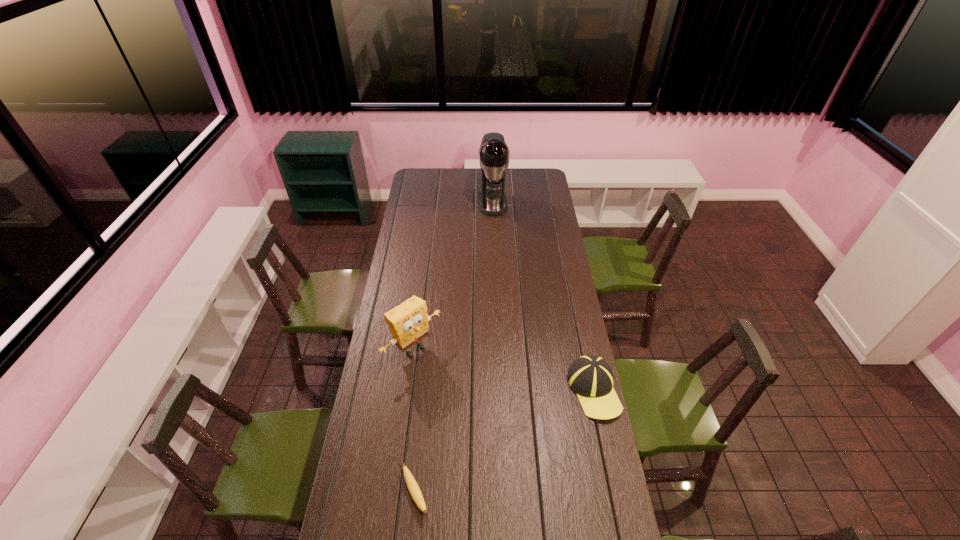
In order to click on object that is the closest to the sponge in this screenshot , I will do tap(412, 485).

Identify the location of object that is the third closest to the second shortest object. (494, 153).